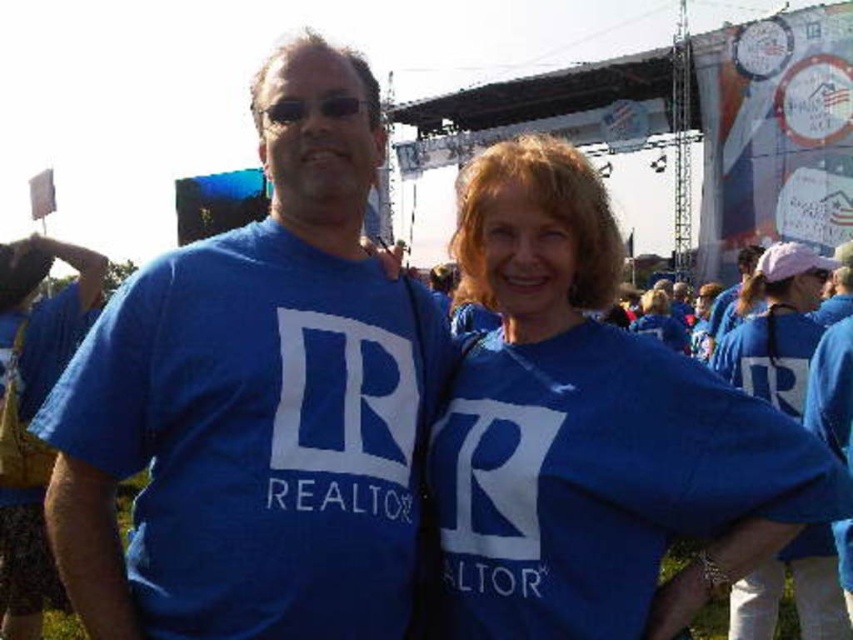
Can you confirm if matte blue shirt at left is smaller than blue fabric shirt at center?

Incorrect, matte blue shirt at left is not smaller in size than blue fabric shirt at center.

Is point (117, 435) farther from viewer compared to point (672, 326)?

No, (117, 435) is in front of (672, 326).

Where is `matte blue shirt at left`? The height and width of the screenshot is (640, 853). matte blue shirt at left is located at coordinates (256, 403).

In the scene shown: Between matte blue shirt at left and matte blue shirt at center, which one appears on the left side from the viewer's perspective?

From the viewer's perspective, matte blue shirt at left appears more on the left side.

Is point (381, 483) in front of point (782, 456)?

That is False.

Is point (123, 369) less distant than point (631, 577)?

No.

This screenshot has width=853, height=640. Identify the location of matte blue shirt at left. (256, 403).

Is matte blue shirt at right shorter than blue fabric shirt at center?

In fact, matte blue shirt at right may be taller than blue fabric shirt at center.

Is point (750, 387) positioned in front of point (685, 332)?

That is True.

At what (x,y) coordinates should I click in order to perform the action: click on matte blue shirt at right. Please return your answer as a coordinate pair (x, y). This screenshot has width=853, height=640. Looking at the image, I should click on (775, 326).